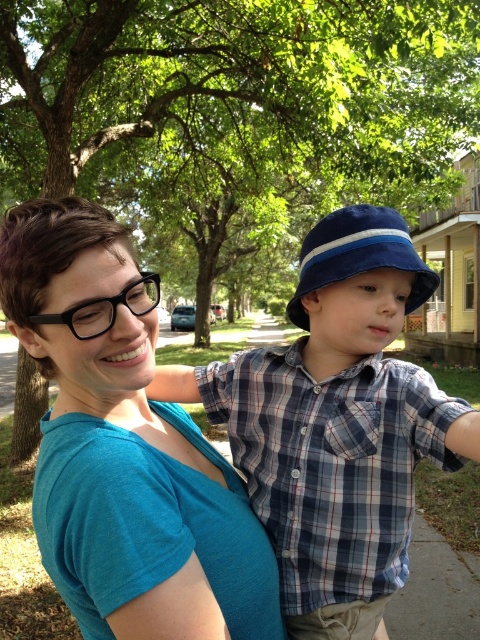
You are a photographer standing 1 meter away from the camera. You want to take a photo of the teal matte shirt at center. Can you reach it with your hand without moving your feet?

The teal matte shirt at center is 69.62 centimeters away from camera. Since you are standing 1 meter away from the camera, the shirt is closer to you than your current position. You can extend your hand to reach it.

You are a photographer trying to capture a closeup of the teal matte shirt at center and the blue fabric hat at center. Given that your camera can only focus on one object at a time, which object should you focus on first to ensure it appears clearer in the photo?

The teal matte shirt at center is larger in size than the blue fabric hat at center, so focusing on the teal matte shirt at center first will ensure it appears clearer in the photo.